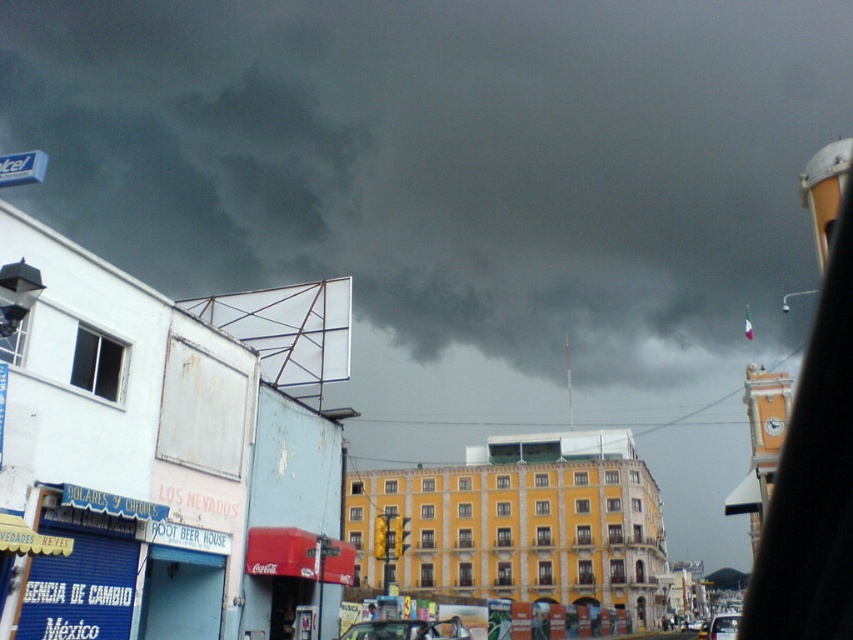
You are a weather observer noting the stormy conditions. You see the dark gray cloud at upper center and the metallic blue street sign at upper left. Which object appears bigger in the scene?

The dark gray cloud at upper center appears bigger than the metallic blue street sign at upper left because it has a larger size compared to the metallic blue street sign at upper left.

You are a pedestrian looking up at the dark gray cloud at upper center and the metallic blue street sign at upper left. Which object is located to the right of the other?

The dark gray cloud at upper center is positioned on the right side of the metallic blue street sign at upper left.

You are a weather observer noting the stormy sky. You see the dark gray cloud at upper center and the metallic clock tower at upper right. Which object is taller in the image?

The dark gray cloud at upper center is taller than the metallic clock tower at upper right.